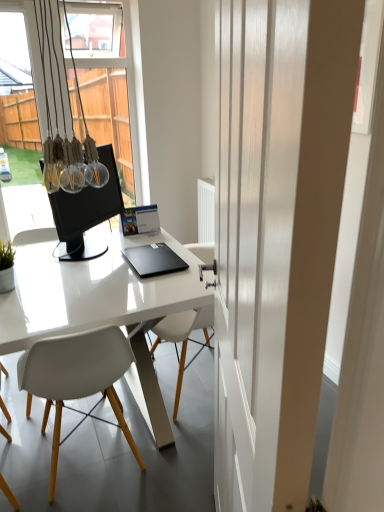
This screenshot has width=384, height=512. Find the location of `free spot to the left of black matte laptop at center`. free spot to the left of black matte laptop at center is located at coordinates (89, 264).